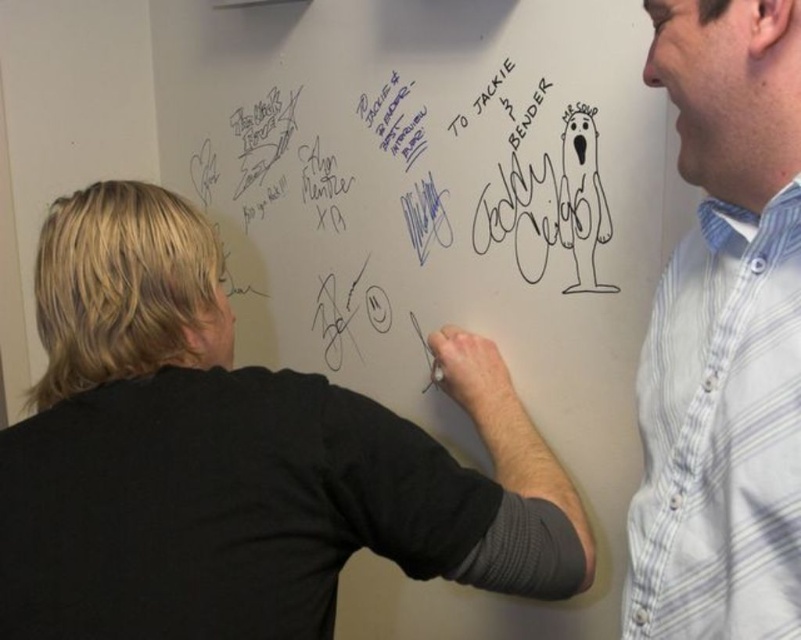
You are standing in front of the whiteboard and want to hand a marker to the person wearing the black shirt at left. Which direction should you move to reach them first without passing through the white striped shirt at upper right?

The black shirt at left is located below the white striped shirt at upper right, so you should move downward to reach the black shirt at left first without passing through the other person.

You are standing in front of the whiteboard and want to hand a marker to the person wearing the black shirt at left. Where should you aim to place the marker so that it reaches them?

The black shirt at left is located at point (236, 458), so you should aim to place the marker near that coordinate to reach them.

You are standing in front of the whiteboard and want to hand a marker to the person wearing the black shirt at left. To do this, in which direction should you move your hand relative to your current position?

Since the black shirt at left is located at point 0.716 on the x axis and 0.297 on the y axis, you should move your hand towards the lower right direction to reach them.